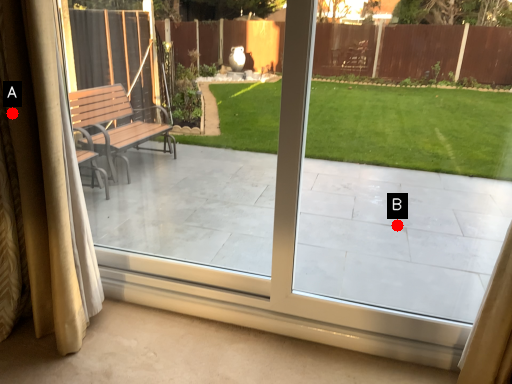
Question: Two points are circled on the image, labeled by A and B beside each circle. Which point is farther from the camera taking this photo?

Choices:
 (A) A is further
 (B) B is further

Answer: (B)